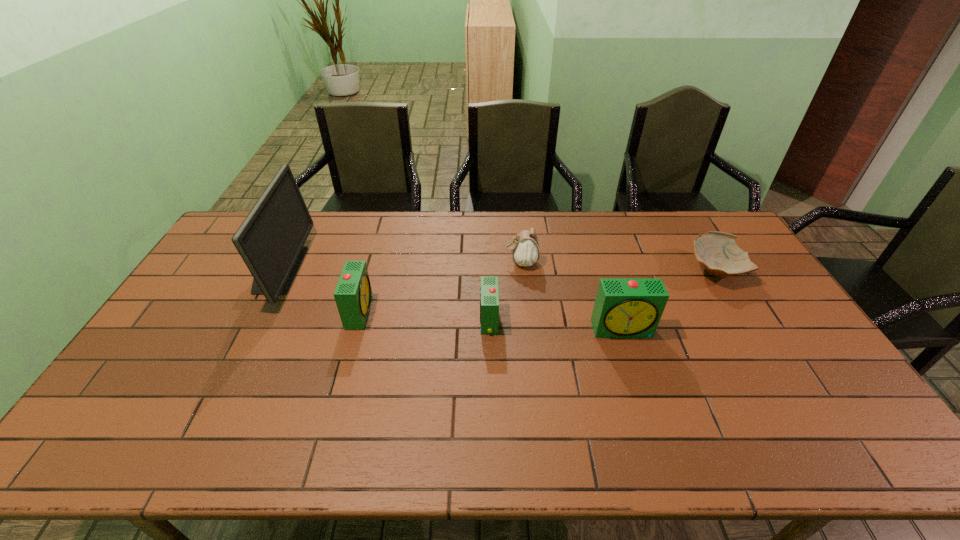
The height and width of the screenshot is (540, 960). I want to click on object situated at the far edge, so click(271, 239).

Image resolution: width=960 pixels, height=540 pixels. Identify the location of object that is at the right edge. (718, 252).

Identify the location of vacant space at the far edge. (371, 215).

Find the location of `vacant space at the left edge`. vacant space at the left edge is located at coordinates (172, 336).

You are a GUI agent. You are given a task and a screenshot of the screen. Output one action in this format:
    pyautogui.click(x=<x>, y=<y>)
    Task: Click on the vacant space at the right edge of the desktop
    The height and width of the screenshot is (540, 960).
    Given the screenshot: What is the action you would take?
    pyautogui.click(x=751, y=302)

Where is `free space that is in between the leftmost object and the fifth object from right to left`? free space that is in between the leftmost object and the fifth object from right to left is located at coordinates (319, 291).

Where is `vacant area between the fifth object from right to left and the fourth object from right to left`? vacant area between the fifth object from right to left and the fourth object from right to left is located at coordinates (424, 315).

Identify the location of free spot between the rightmost alarm clock and the shortest alarm clock. (556, 325).

Identify the location of vacant area between the pottery and the leftmost object. This screenshot has width=960, height=540. (496, 269).

Locate an element on the screen. Image resolution: width=960 pixels, height=540 pixels. free space between the tallest object and the rightmost alarm clock is located at coordinates (450, 299).